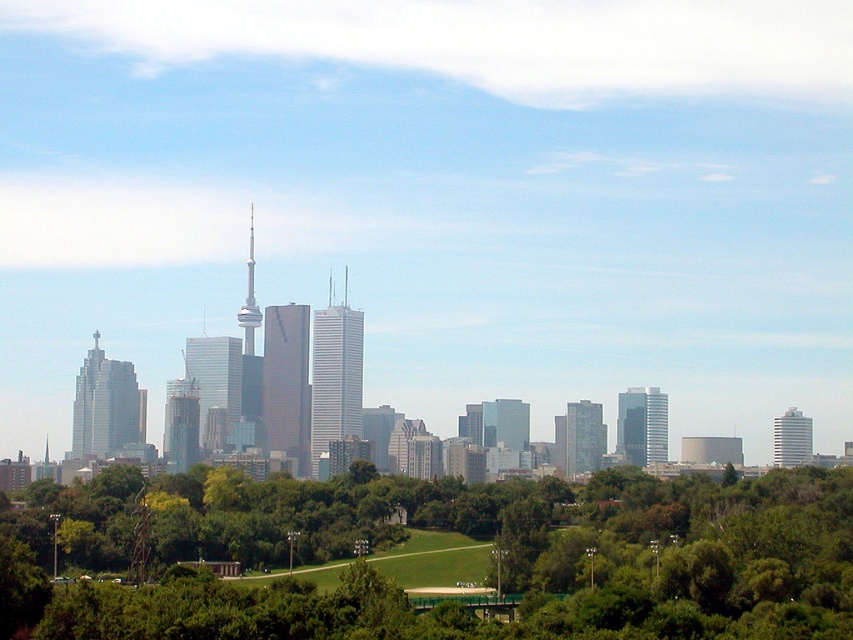
Question: Which object is positioned farthest from the glassy silver skyscraper at center-right?

Choices:
 (A) white glossy building at right
 (B) matte glass skyscraper at center-left
 (C) glassy reflective skyscraper at center
 (D) green leafy tree at center

Answer: (B)

Question: Which object is positioned farthest from the glassy silver skyscraper at center-right?

Choices:
 (A) matte glass skyscraper at center-left
 (B) white glossy building at right
 (C) shiny glass tower at center

Answer: (A)

Question: Estimate the real-world distances between objects in this image. Which object is farther from the shiny glass tower at center?

Choices:
 (A) green grassy field at center
 (B) green leafy tree at center
 (C) smooth glass skyscraper at center
 (D) glassy reflective skyscraper at center

Answer: (B)

Question: Does glassy reflective skyscraper at center appear over glassy concrete skyscraper at center?

Choices:
 (A) yes
 (B) no

Answer: (A)

Question: Can you confirm if white glossy building at right is bigger than shiny glass tower at center?

Choices:
 (A) no
 (B) yes

Answer: (A)

Question: Does glassy concrete skyscraper at center lie behind shiny glass tower at center?

Choices:
 (A) yes
 (B) no

Answer: (A)